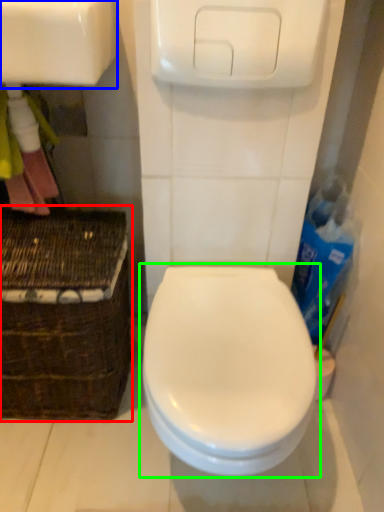
Question: Which object is positioned farthest from basket (highlighted by a red box)? Select from sink (highlighted by a blue box) and toilet (highlighted by a green box).

Choices:
 (A) sink
 (B) toilet

Answer: (A)